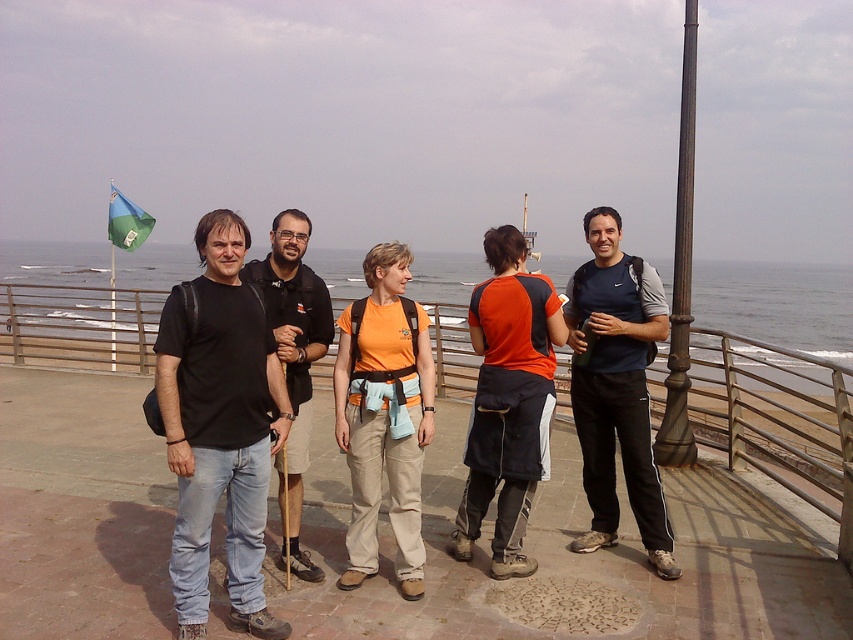
Question: Is orange fabric backpack at center wider than bronze/golden metal pole at right?

Choices:
 (A) yes
 (B) no

Answer: (B)

Question: Which object is the closest to the dark blue athletic pants at center?

Choices:
 (A) metal at left
 (B) orange fabric shirt at center

Answer: (B)

Question: Which point is farther to the camera?

Choices:
 (A) metal at left
 (B) orange fabric backpack at center

Answer: (A)

Question: Which point is farther to the camera?

Choices:
 (A) (421, 568)
 (B) (827, 362)

Answer: (B)

Question: Does dark blue athletic pants at center appear under blue fabric flag at upper left?

Choices:
 (A) yes
 (B) no

Answer: (A)

Question: Is orange fabric shirt at center further to camera compared to black matte shirt at center?

Choices:
 (A) yes
 (B) no

Answer: (A)